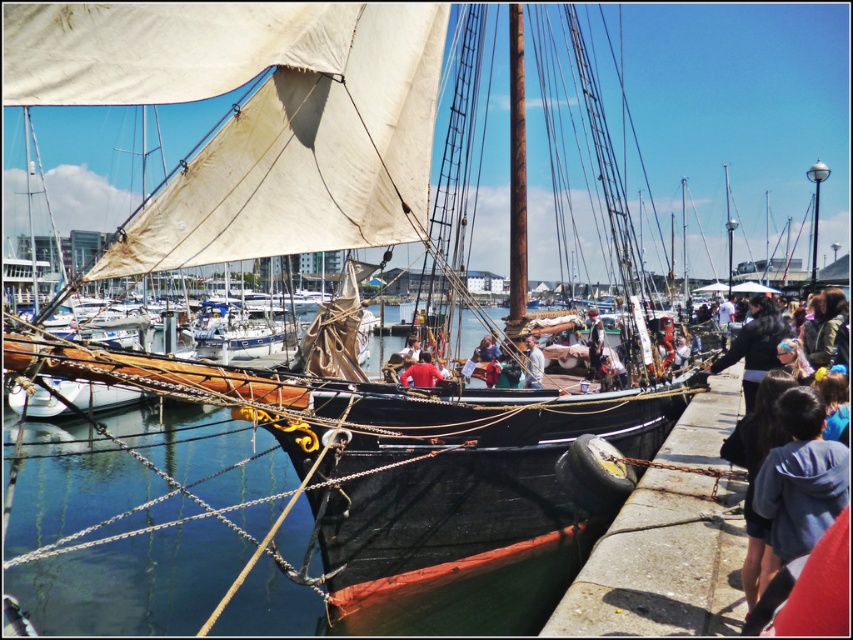
You are standing at the marina and see the denim jacket at right and the rusty wood mast at center. Which object is closer to you?

The denim jacket at right is closer to you because it is positioned under the rusty wood mast at center, indicating it is in a lower spatial plane.

You are a photographer at the marina and want to capture both the denim jacket at right and the red matte shirt at center in your shot. Since you need to focus on the smaller object first, which one should you adjust your camera settings for first?

The red matte shirt at center is smaller than the denim jacket at right, so you should adjust your camera settings for the red matte shirt at center first to ensure proper focus on the smaller object.